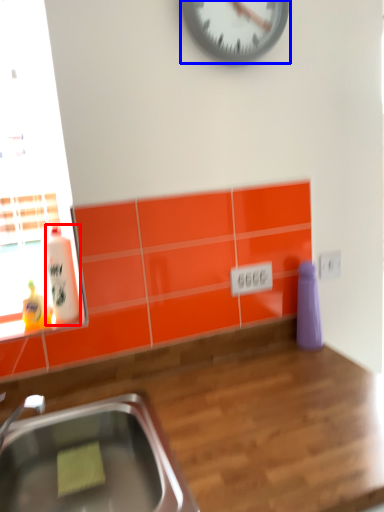
Question: Which object appears closest to the camera in this image, bottle (highlighted by a red box) or wall clock (highlighted by a blue box)?

Choices:
 (A) bottle
 (B) wall clock

Answer: (B)